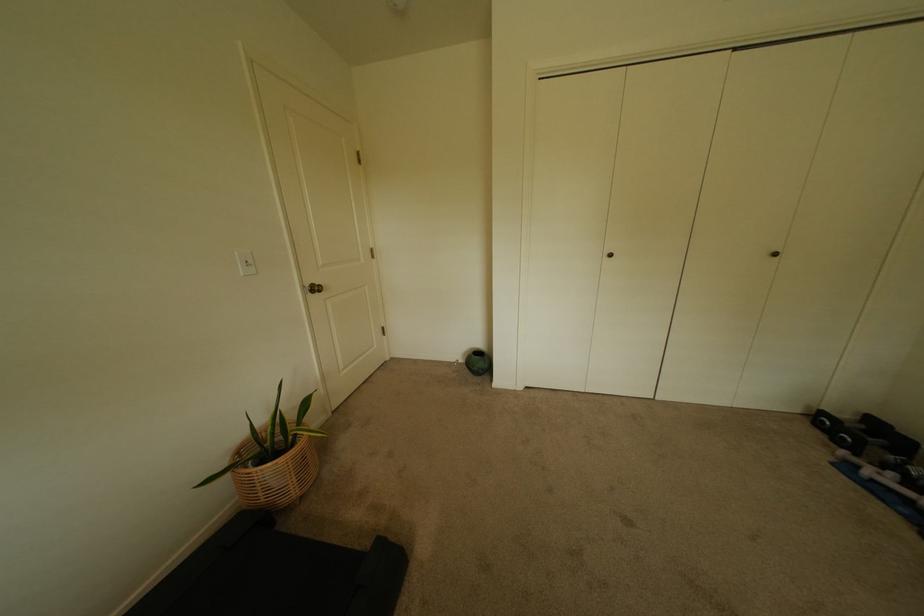
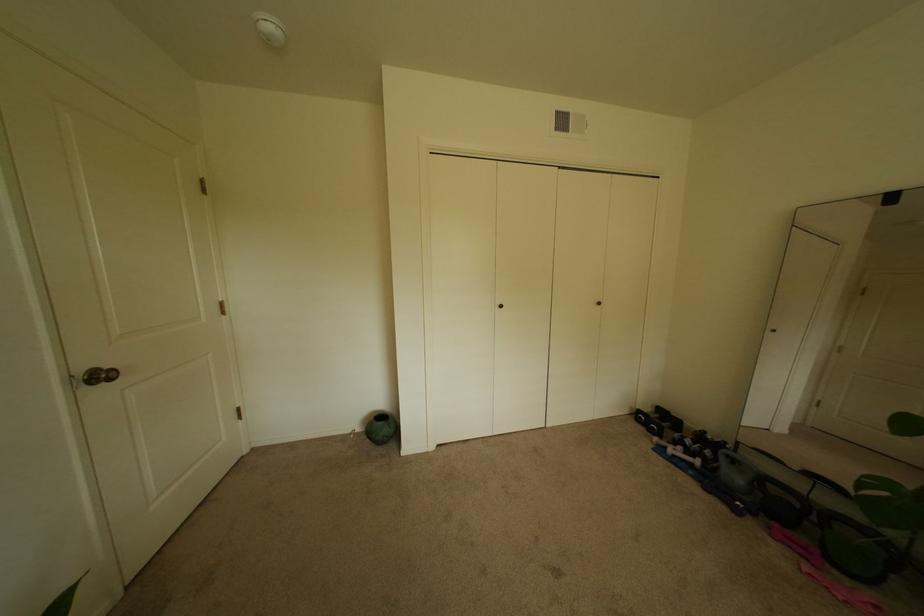
Question: Based on the continuous images, in which direction is the camera rotating? Reply with the corresponding letter.

Choices:
 (A) Left
 (B) Right
 (C) Up
 (D) Down

Answer: (B)